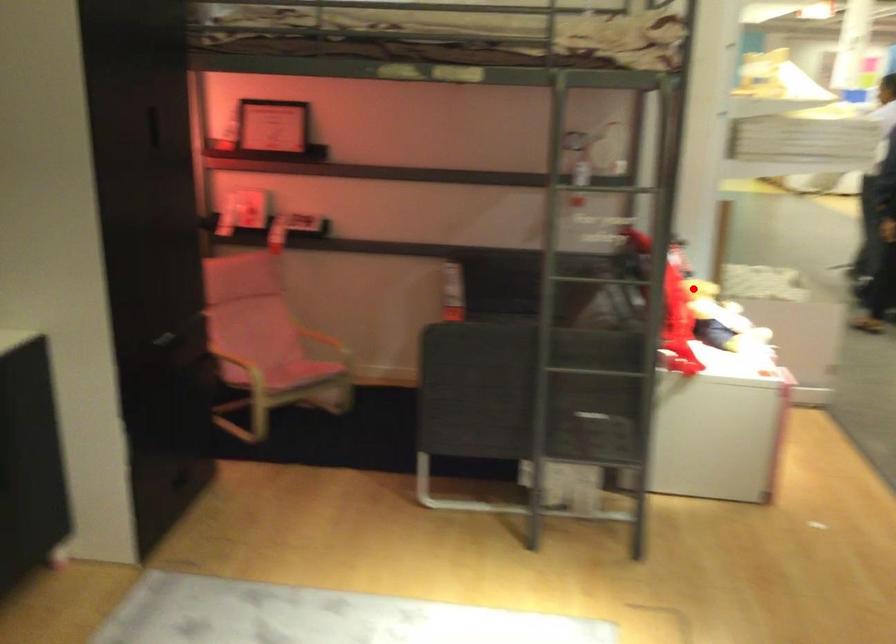
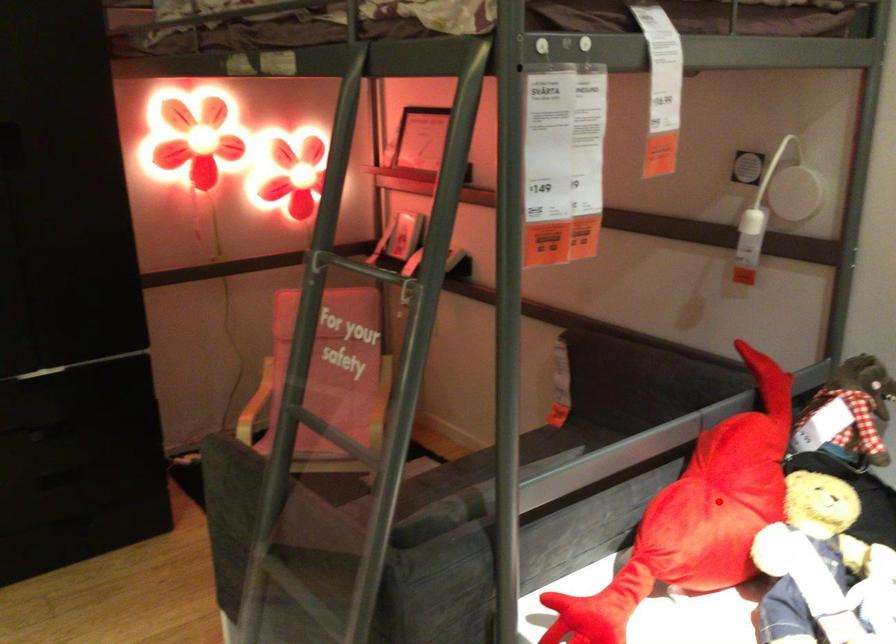
I am providing you with two images of the same scene from different viewpoints. A red point is marked on the first image and another point is marked on the second image. Is the marked point in image1 the same physical position as the marked point in image2?

Yes